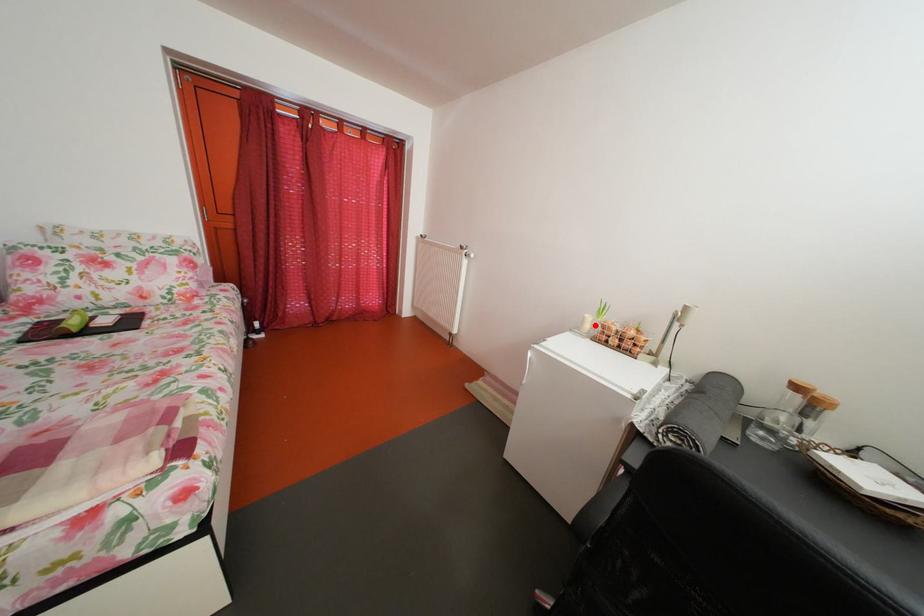
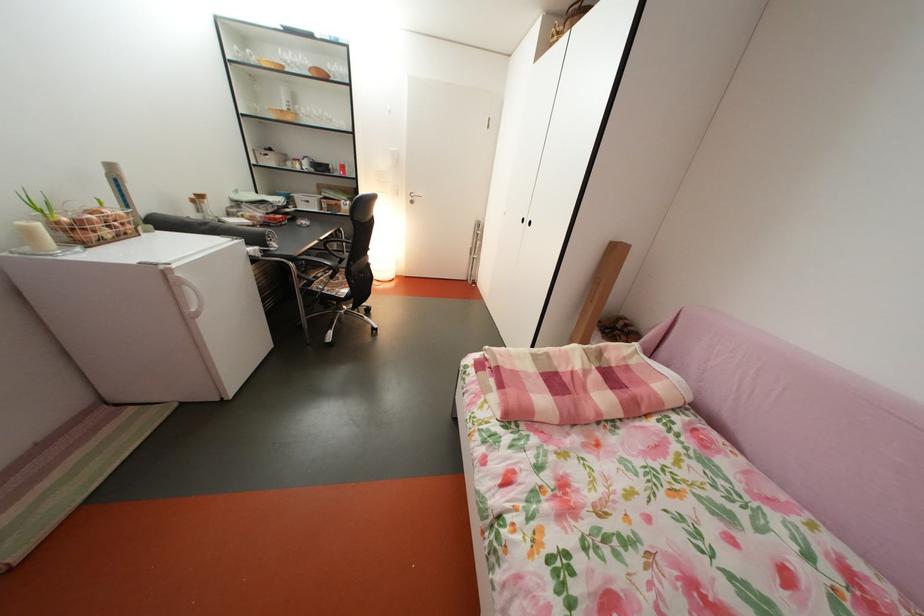
Question: A red point is marked in image1. In image2, is the corresponding 3D point closer to the camera or farther? Reply with the corresponding letter.

Choices:
 (A) The corresponding 3D point is closer.
 (B) The corresponding 3D point is farther.

Answer: (B)